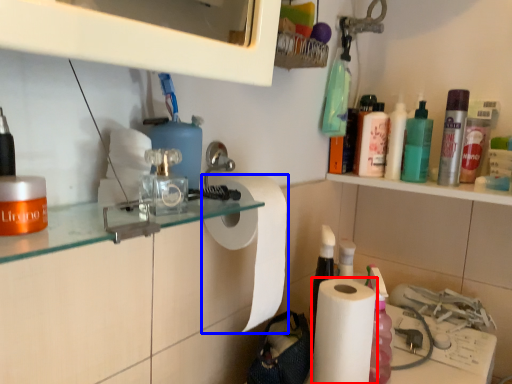
Question: Which object is further to the camera taking this photo, paper towel (highlighted by a red box) or paper towel (highlighted by a blue box)?

Choices:
 (A) paper towel
 (B) paper towel

Answer: (A)